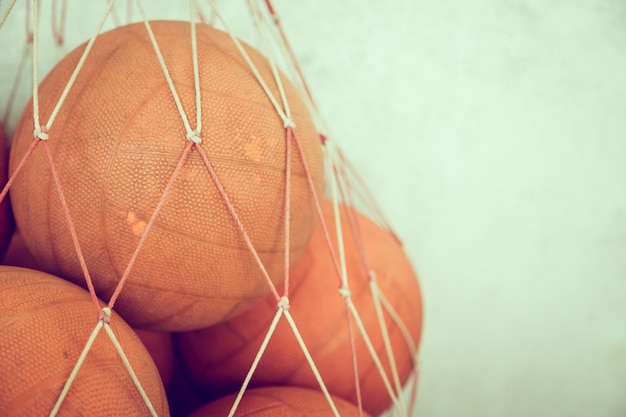
The width and height of the screenshot is (626, 417). Find the location of `wall`. wall is located at coordinates (444, 153).